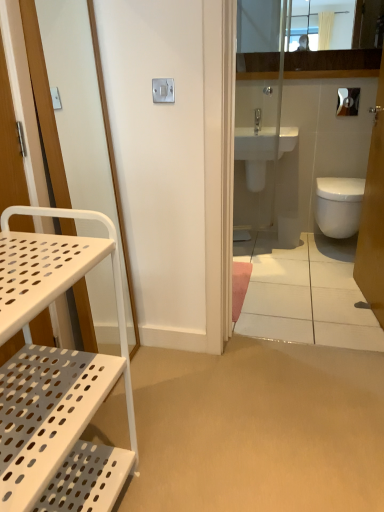
Image resolution: width=384 pixels, height=512 pixels. What are the coordinates of `free space between white glossy screen door at upper right, arranged as the 2th screen door when viewed from the left, and white glossy bidet at right, the second bidet viewed from the left` in the screenshot? It's located at (336, 282).